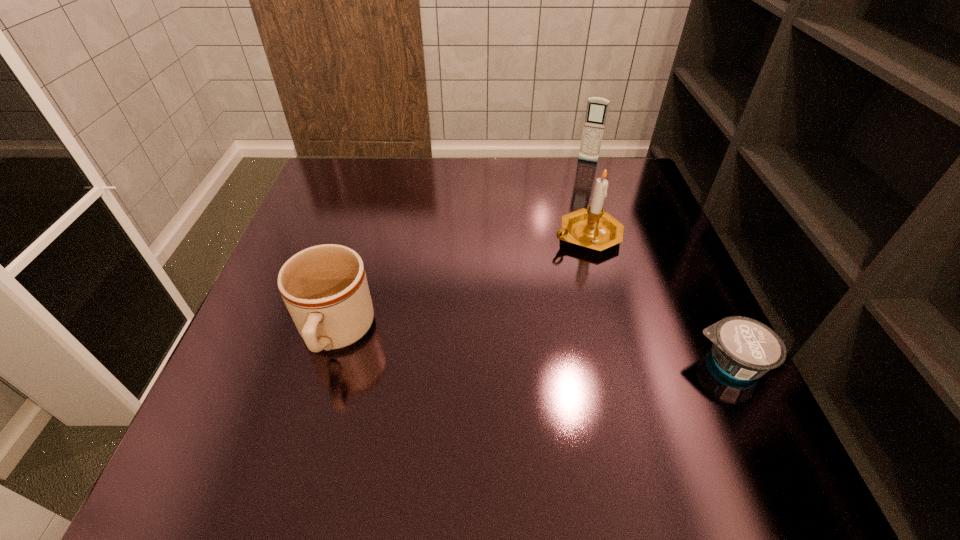
Identify the location of cellular telephone that is at the right edge. (597, 108).

Locate an element on the screen. The width and height of the screenshot is (960, 540). object that is at the near left corner is located at coordinates (325, 289).

Identify the location of object at the far right corner. Image resolution: width=960 pixels, height=540 pixels. (597, 108).

Where is `object located in the near right corner section of the desktop`? Image resolution: width=960 pixels, height=540 pixels. object located in the near right corner section of the desktop is located at coordinates (743, 348).

Identify the location of blank space at the far edge of the desktop. This screenshot has height=540, width=960. (493, 161).

This screenshot has width=960, height=540. What are the coordinates of `blank space at the near edge of the desktop` in the screenshot? It's located at (378, 416).

You are a GUI agent. You are given a task and a screenshot of the screen. Output one action in this format:
    pyautogui.click(x=<x>, y=<y>)
    Task: Click on the free space at the left edge of the desktop
    
    Given the screenshot: What is the action you would take?
    pyautogui.click(x=328, y=220)

In order to click on vacant space at the right edge in this screenshot , I will do `click(638, 348)`.

Find the location of `free space at the far left corner of the desktop`. free space at the far left corner of the desktop is located at coordinates (355, 168).

The image size is (960, 540). In the image, there is a desktop. Identify the location of vacant area at the far right corner. (597, 174).